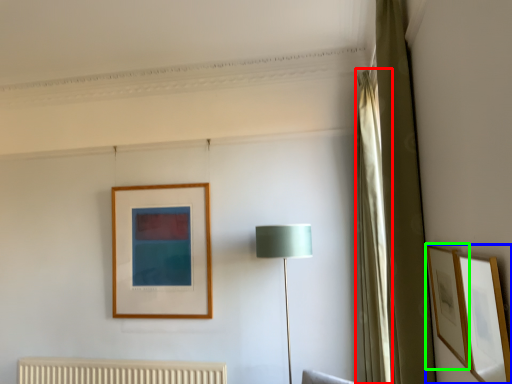
Question: Based on their relative distances, which object is farther from curtain (highlighted by a red box)? Choose from picture frame (highlighted by a blue box) and picture frame (highlighted by a green box).

Choices:
 (A) picture frame
 (B) picture frame

Answer: (A)